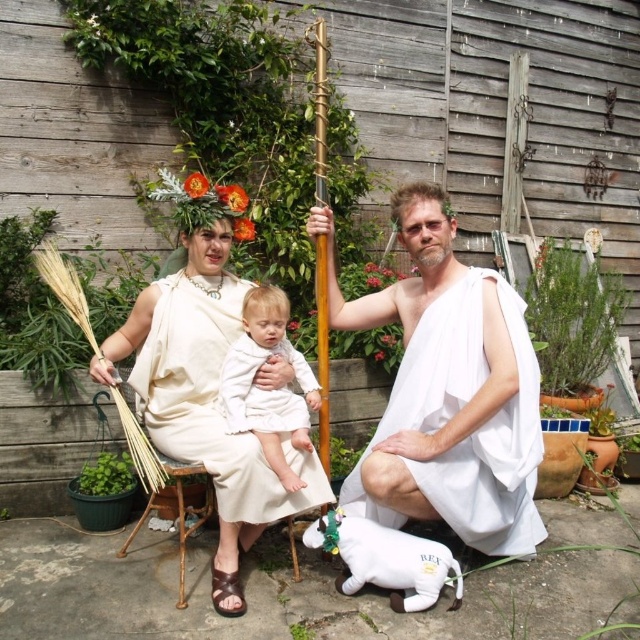
Between white cloth toga at center and matte white toga at center, which one is positioned lower?

matte white toga at center is below.

Does white cloth toga at center appear on the right side of matte white toga at center?

Indeed, white cloth toga at center is positioned on the right side of matte white toga at center.

Between point (403, 289) and point (225, 529), which one is positioned behind?

Point (403, 289)

Locate an element on the screen. This screenshot has width=640, height=640. white cloth toga at center is located at coordinates (449, 392).

Can you confirm if white cloth toga at center is taller than white soft fabric baby at center?

Yes, white cloth toga at center is taller than white soft fabric baby at center.

The height and width of the screenshot is (640, 640). Identify the location of white cloth toga at center. (449, 392).

Locate an element on the screen. The width and height of the screenshot is (640, 640). white cloth toga at center is located at coordinates (449, 392).

Does point (240, 301) lie behind point (288, 340)?

Yes, it is behind point (288, 340).

Which is behind, point (177, 310) or point (234, 428)?

The point (177, 310) is more distant.

Locate an element on the screen. Image resolution: width=640 pixels, height=640 pixels. matte white toga at center is located at coordinates 205,387.